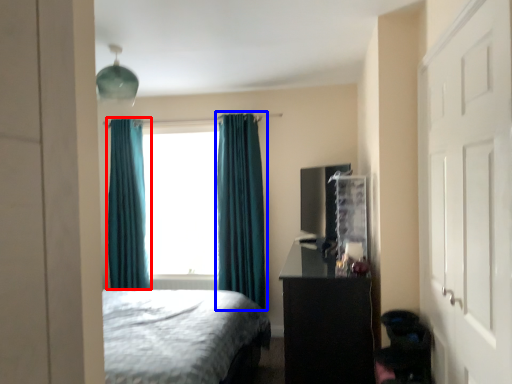
Question: Which object appears closest to the camera in this image, curtain (highlighted by a red box) or curtain (highlighted by a blue box)?

Choices:
 (A) curtain
 (B) curtain

Answer: (B)